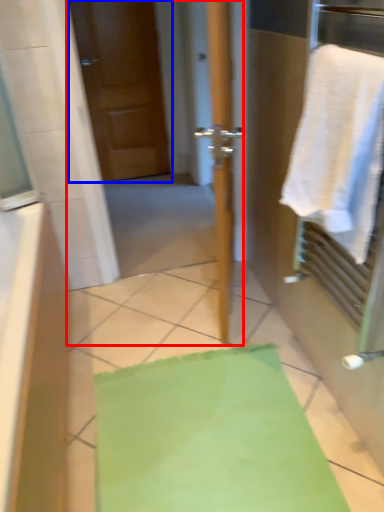
Question: Which of the following is the farthest to the observer, screen door (highlighted by a red box) or door (highlighted by a blue box)?

Choices:
 (A) screen door
 (B) door

Answer: (B)